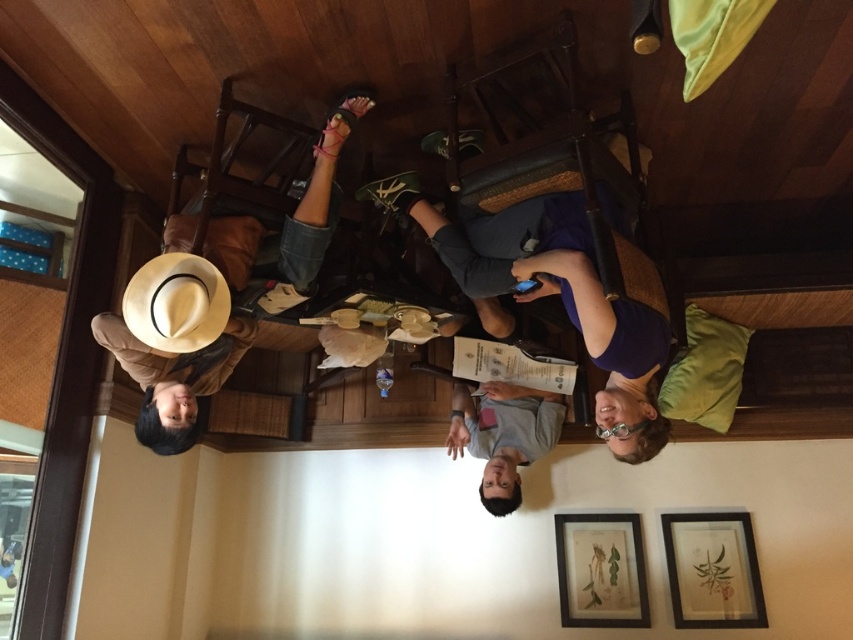
Is purple fabric at center below light brown straw hat at lower left?

No.

Is purple fabric at center positioned behind light brown straw hat at lower left?

No, purple fabric at center is closer to the viewer.

Identify the location of purple fabric at center. The height and width of the screenshot is (640, 853). (554, 294).

Is purple fabric at center below white felt cowboy hat at upper left?

No.

Describe the element at coordinates (554, 294) in the screenshot. I see `purple fabric at center` at that location.

The image size is (853, 640). I want to click on purple fabric at center, so click(x=554, y=294).

Does point (209, 275) come behind point (219, 310)?

No, (209, 275) is in front of (219, 310).

Which is more to the right, light brown straw hat at lower left or white felt cowboy hat at upper left?

white felt cowboy hat at upper left is more to the right.

Between point (157, 262) and point (222, 321), which one is positioned behind?

The point (222, 321) is behind.

Where is `light brown straw hat at lower left`? light brown straw hat at lower left is located at coordinates (173, 353).